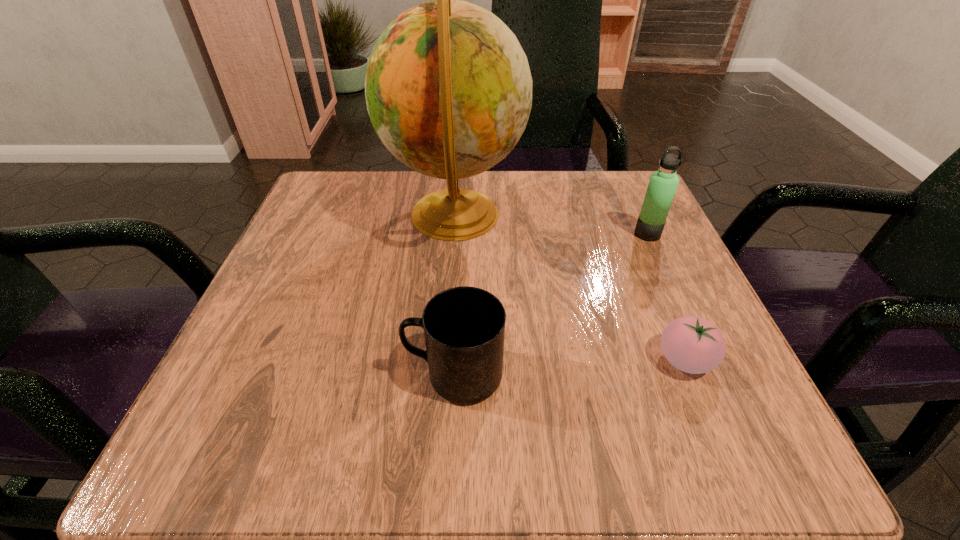
The height and width of the screenshot is (540, 960). Find the location of `vacant area between the globe and the thermos bottle`. vacant area between the globe and the thermos bottle is located at coordinates (551, 224).

Where is `the third closest object to the shortest object`? the third closest object to the shortest object is located at coordinates (663, 183).

Locate an element on the screen. Image resolution: width=960 pixels, height=540 pixels. object that is the closest to the third tallest object is located at coordinates (448, 88).